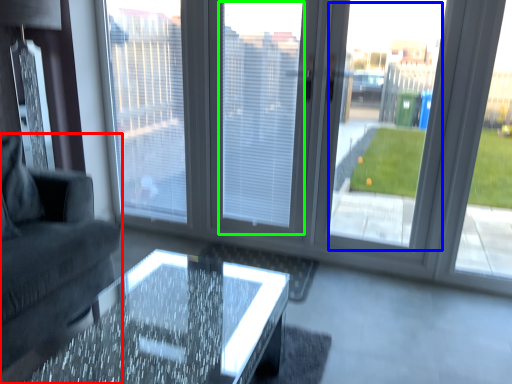
Question: Considering the real-world distances, which object is farthest from studio couch (highlighted by a red box)? window screen (highlighted by a blue box) or window screen (highlighted by a green box)?

Choices:
 (A) window screen
 (B) window screen

Answer: (A)